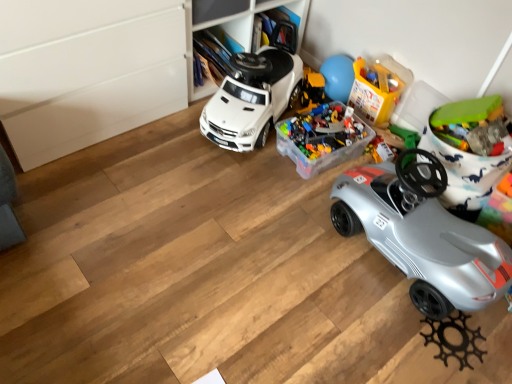
Question: In which direction should I rotate to look at translucent plastic container at upper center, arranged as the 2th toy when viewed from the left?

Choices:
 (A) right
 (B) left

Answer: (A)

Question: Is translucent plastic container at center, which is counted as the third toy, starting from the right, wider than white matte toy car at center, the 1th car positioned from the left?

Choices:
 (A) no
 (B) yes

Answer: (A)

Question: Is translucent plastic container at center, the 1th toy positioned from the left, surrounding white matte toy car at center, positioned as the 2th car in right-to-left order?

Choices:
 (A) no
 (B) yes

Answer: (A)

Question: Considering the relative positions of translucent plastic container at center, which is counted as the third toy, starting from the right, and white matte toy car at center, the 1th car positioned from the left, in the image provided, is translucent plastic container at center, which is counted as the third toy, starting from the right, behind white matte toy car at center, the 1th car positioned from the left,?

Choices:
 (A) yes
 (B) no

Answer: (A)

Question: Can you confirm if translucent plastic container at center, which is counted as the third toy, starting from the right, is smaller than white matte toy car at center, the 1th car positioned from the left?

Choices:
 (A) no
 (B) yes

Answer: (B)

Question: Is translucent plastic container at center, the 1th toy positioned from the left, with white matte toy car at center, positioned as the 2th car in right-to-left order?

Choices:
 (A) no
 (B) yes

Answer: (A)

Question: Can you confirm if translucent plastic container at center, which is counted as the third toy, starting from the right, is positioned to the left of white matte toy car at center, the 1th car positioned from the left?

Choices:
 (A) yes
 (B) no

Answer: (B)

Question: Considering the relative positions of silver metallic car at lower right, placed as the first car when sorted from right to left, and translucent plastic container at upper center, the 2th toy viewed from the right, in the image provided, is silver metallic car at lower right, placed as the first car when sorted from right to left, to the left of translucent plastic container at upper center, the 2th toy viewed from the right, from the viewer's perspective?

Choices:
 (A) yes
 (B) no

Answer: (B)

Question: Considering the relative positions of silver metallic car at lower right, the 2th car viewed from the left, and translucent plastic container at upper center, the 2th toy viewed from the right, in the image provided, is silver metallic car at lower right, the 2th car viewed from the left, to the right of translucent plastic container at upper center, the 2th toy viewed from the right, from the viewer's perspective?

Choices:
 (A) no
 (B) yes

Answer: (B)

Question: Is silver metallic car at lower right, placed as the first car when sorted from right to left, facing towards translucent plastic container at upper center, the 2th toy viewed from the right?

Choices:
 (A) yes
 (B) no

Answer: (B)

Question: From the image's perspective, is silver metallic car at lower right, the 2th car viewed from the left, located beneath translucent plastic container at upper center, the 2th toy viewed from the right?

Choices:
 (A) yes
 (B) no

Answer: (A)

Question: Does silver metallic car at lower right, placed as the first car when sorted from right to left, contain translucent plastic container at upper center, the 2th toy viewed from the right?

Choices:
 (A) no
 (B) yes

Answer: (A)

Question: Is silver metallic car at lower right, the 2th car viewed from the left, oriented away from translucent plastic container at upper center, arranged as the 2th toy when viewed from the left?

Choices:
 (A) no
 (B) yes

Answer: (A)

Question: Is translucent plastic container at upper center, arranged as the 2th toy when viewed from the left, aimed at silver metallic car at lower right, placed as the first car when sorted from right to left?

Choices:
 (A) no
 (B) yes

Answer: (A)